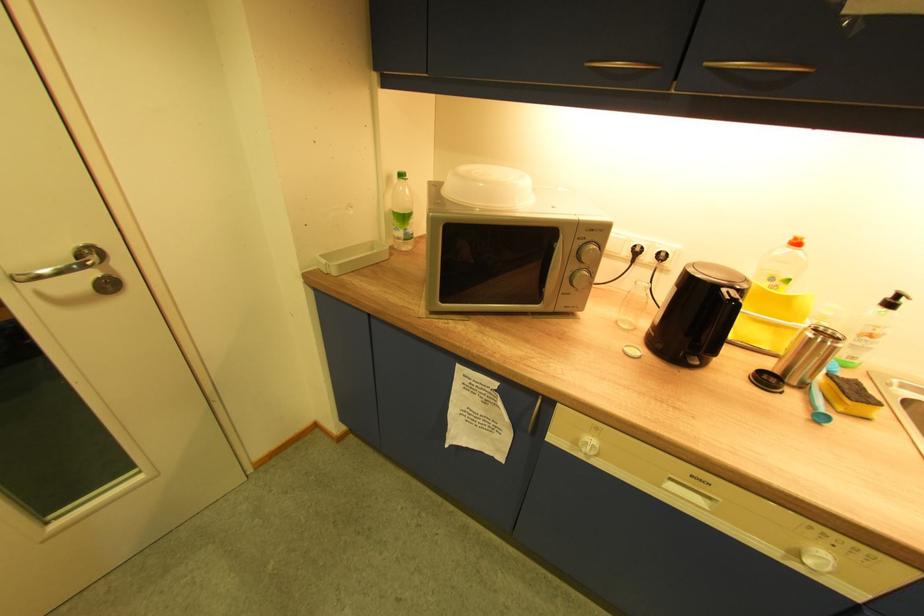
Find where to push the orange bottle cap. Please return your answer as a coordinate pair (x, y).

(796, 241)